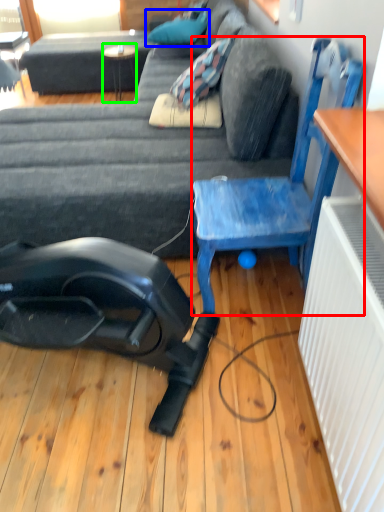
Question: Which object is positioned closest to chair (highlighted by a red box)? Select from pillow (highlighted by a blue box) and table (highlighted by a green box).

Choices:
 (A) pillow
 (B) table

Answer: (A)